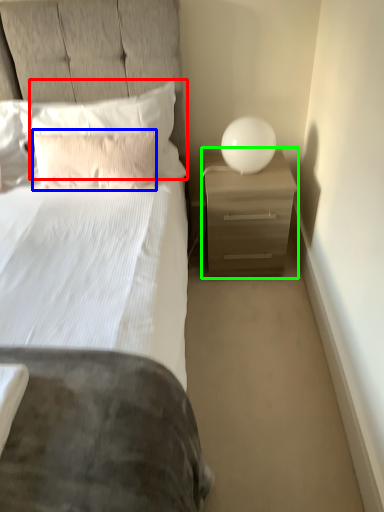
Question: Estimate the real-world distances between objects in this image. Which object is closer to pillow (highlighted by a red box), pillow (highlighted by a blue box) or nightstand (highlighted by a green box)?

Choices:
 (A) pillow
 (B) nightstand

Answer: (A)